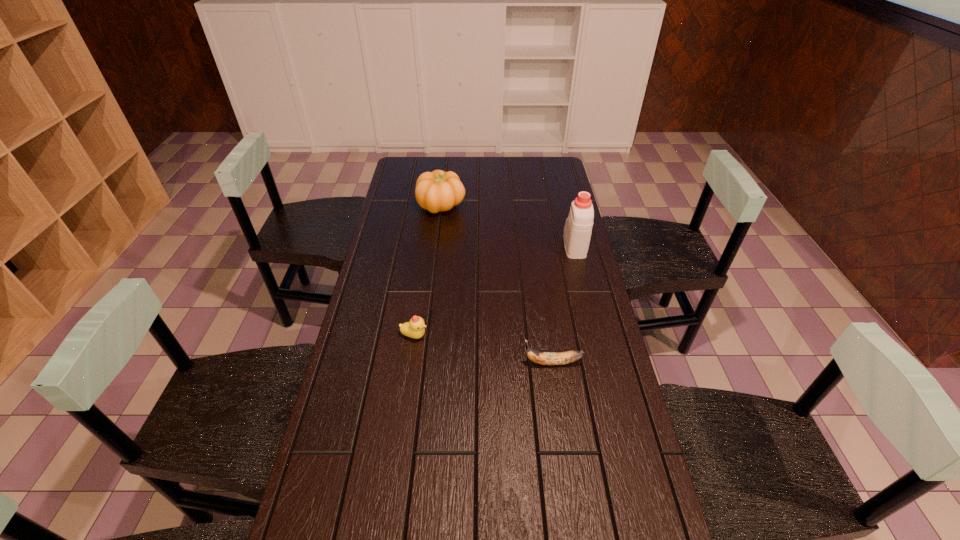
Identify the location of free space located 0.130m on the right of the farthest object. (496, 205).

Where is `vacant point located at the stem of the nearest object`? vacant point located at the stem of the nearest object is located at coordinates (475, 363).

The height and width of the screenshot is (540, 960). In order to click on free region located 0.360m at the stem of the nearest object in this screenshot , I will do `click(398, 363)`.

You are a GUI agent. You are given a task and a screenshot of the screen. Output one action in this format:
    pyautogui.click(x=<x>, y=<y>)
    Task: Click on the blank area located 0.360m at the stem of the nearest object
    The height and width of the screenshot is (540, 960).
    Given the screenshot: What is the action you would take?
    pyautogui.click(x=398, y=363)

Locate an element on the screen. This screenshot has height=540, width=960. free space located 0.300m on the front-facing side of the duckling is located at coordinates (527, 336).

This screenshot has height=540, width=960. Identify the location of pumpkin that is at the left edge. (435, 191).

This screenshot has width=960, height=540. Find the location of `duckling at the left edge`. duckling at the left edge is located at coordinates (414, 328).

Find the location of `detergent that is at the right edge`. detergent that is at the right edge is located at coordinates (578, 227).

Where is `banana positioned at the right edge`? banana positioned at the right edge is located at coordinates (544, 358).

The height and width of the screenshot is (540, 960). I want to click on free space at the far edge of the desktop, so click(x=451, y=157).